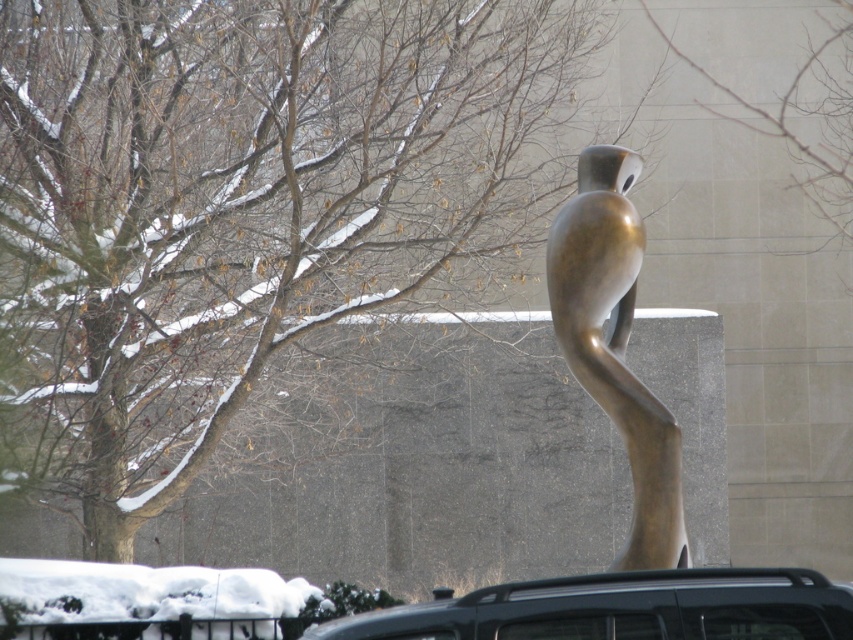
Who is shorter, black matte car at lower center or bronze sculpture at center?

black matte car at lower center is shorter.

The width and height of the screenshot is (853, 640). What do you see at coordinates (622, 609) in the screenshot?
I see `black matte car at lower center` at bounding box center [622, 609].

Find the location of a particular element. The width and height of the screenshot is (853, 640). black matte car at lower center is located at coordinates (622, 609).